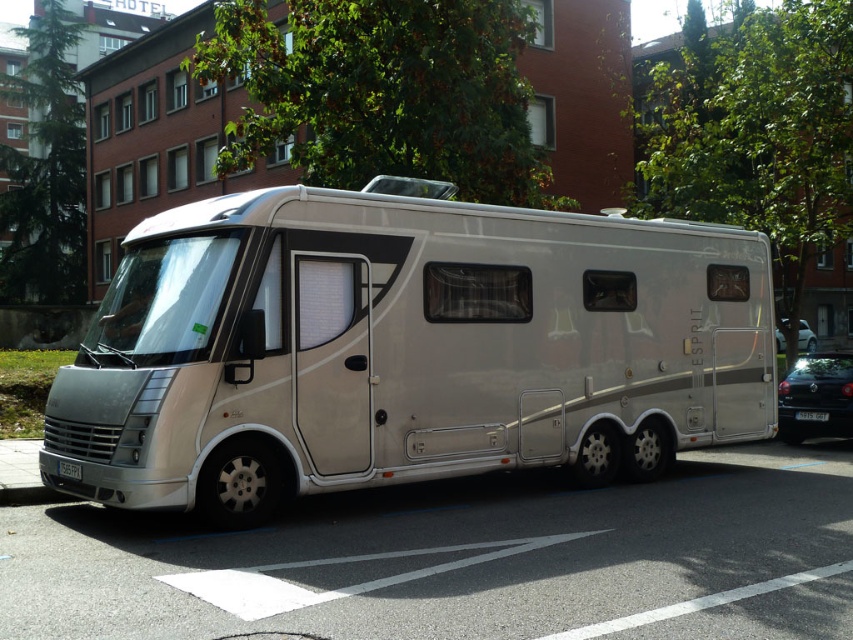
Is metallic silver car at right closer to the viewer compared to black plastic license plate at lower center?

Yes.

Can you confirm if metallic silver car at right is wider than black plastic license plate at lower center?

Yes.

At what (x,y) coordinates should I click in order to perform the action: click on metallic silver car at right. Please return your answer as a coordinate pair (x, y). The image size is (853, 640). Looking at the image, I should click on (805, 337).

Between silver metallic tour bus at center and black glossy sedan at lower right, which one has more height?

silver metallic tour bus at center is taller.

Is point (627, 356) positioned in front of point (804, 381)?

Yes, point (627, 356) is in front of point (804, 381).

Is point (306, 314) positioned before point (802, 356)?

Yes.

Image resolution: width=853 pixels, height=640 pixels. I want to click on silver metallic tour bus at center, so click(x=404, y=349).

What do you see at coordinates (404, 349) in the screenshot?
I see `silver metallic tour bus at center` at bounding box center [404, 349].

Consider the image. Between silver metallic tour bus at center and white plastic license plate at lower center, which one is positioned higher?

silver metallic tour bus at center is above.

The height and width of the screenshot is (640, 853). Find the location of `silver metallic tour bus at center`. silver metallic tour bus at center is located at coordinates (404, 349).